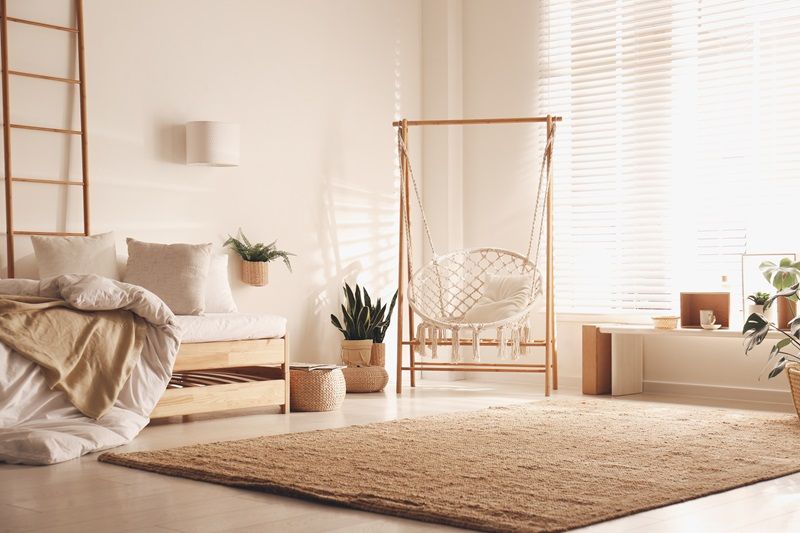
At what (x,y) coordinates should I click in order to perform the action: click on rug. Please return your answer as a coordinate pair (x, y). Looking at the image, I should click on (570, 433).